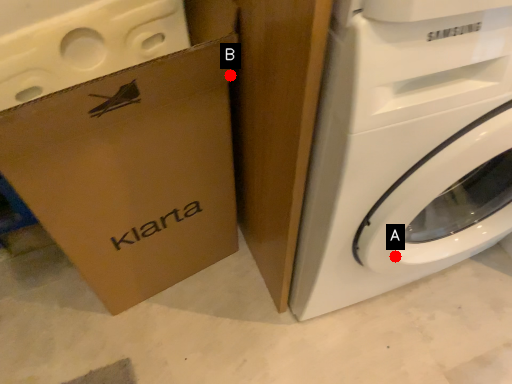
Question: Two points are circled on the image, labeled by A and B beside each circle. Which of the following is the closest to the observer?

Choices:
 (A) A is closer
 (B) B is closer

Answer: (A)